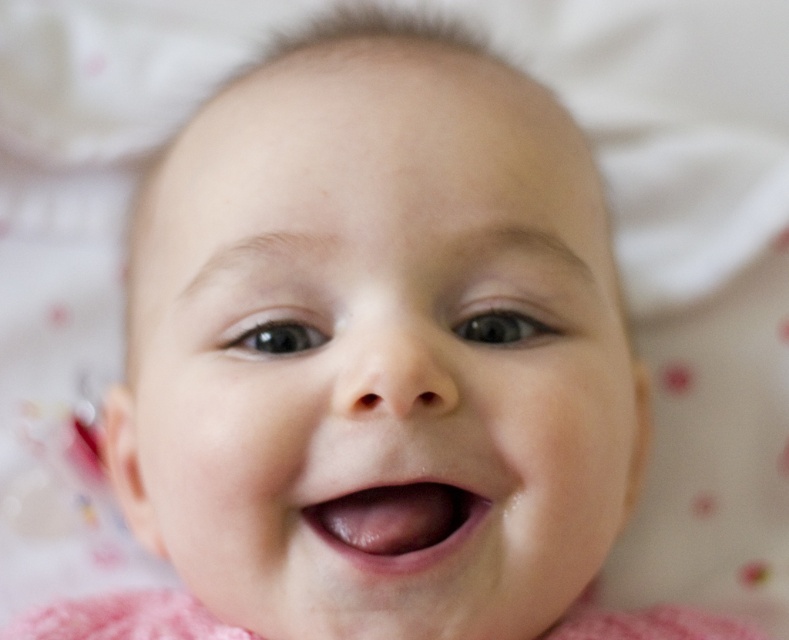
Does smooth skin baby at center have a greater width compared to pink glossy lips at center?

Yes.

What do you see at coordinates (376, 355) in the screenshot?
I see `smooth skin baby at center` at bounding box center [376, 355].

Find the location of a particular element. The image size is (789, 640). smooth skin baby at center is located at coordinates (376, 355).